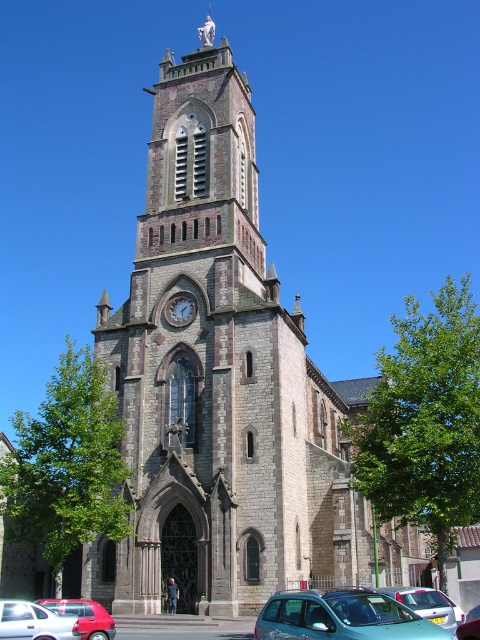
You are a pedestrian standing in front of the grand stone church with Gothic architectural features. You see a teal matte car at lower center and a matte red car at lower left. Which car is closer to you?

The teal matte car at lower center is closer to you because it is positioned over the matte red car at lower left, indicating it is in front.